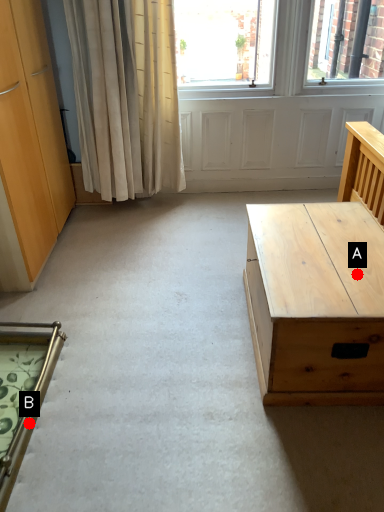
Question: Two points are circled on the image, labeled by A and B beside each circle. Which point appears farthest from the camera in this image?

Choices:
 (A) A is further
 (B) B is further

Answer: (A)